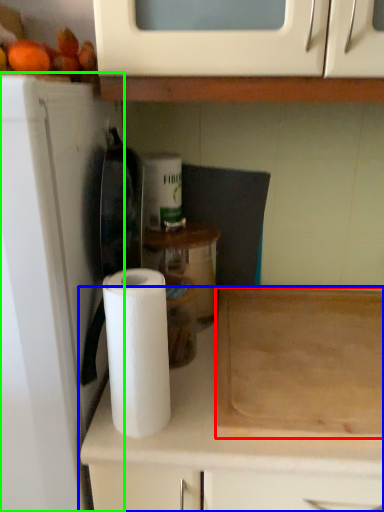
Question: Which is farther away from cutting board (highlighted by a red box)? cabinetry (highlighted by a blue box) or appliance (highlighted by a green box)?

Choices:
 (A) cabinetry
 (B) appliance

Answer: (B)